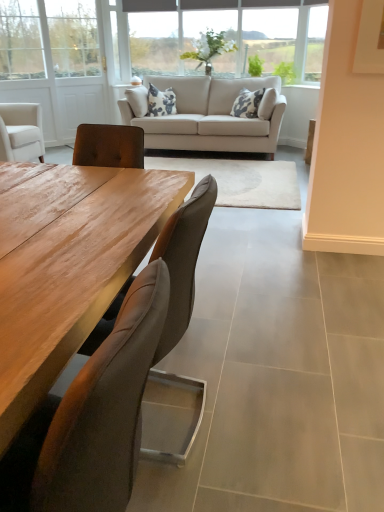
Question: From the image's perspective, is beige fabric couch at center located beneath leather cushioned chair at center, the 1th chair positioned from the front?

Choices:
 (A) no
 (B) yes

Answer: (A)

Question: Can you confirm if beige fabric couch at center is thinner than leather cushioned chair at center, the 2th chair when ordered from back to front?

Choices:
 (A) yes
 (B) no

Answer: (B)

Question: From a real-world perspective, does beige fabric couch at center stand above leather cushioned chair at center, the 1th chair positioned from the front?

Choices:
 (A) no
 (B) yes

Answer: (B)

Question: Is beige fabric couch at center directly adjacent to leather cushioned chair at center, the 1th chair positioned from the front?

Choices:
 (A) no
 (B) yes

Answer: (A)

Question: Is beige fabric couch at center to the left of leather cushioned chair at center, the 2th chair when ordered from back to front, from the viewer's perspective?

Choices:
 (A) yes
 (B) no

Answer: (B)

Question: From the image's perspective, is brown leather chair at center, arranged as the second chair when viewed from the front, located above or below white wood screen door at upper left?

Choices:
 (A) above
 (B) below

Answer: (B)

Question: Would you say brown leather chair at center, arranged as the second chair when viewed from the front, is inside or outside white wood screen door at upper left?

Choices:
 (A) inside
 (B) outside

Answer: (B)

Question: From a real-world perspective, is brown leather chair at center, the first chair positioned from the back, positioned above or below white wood screen door at upper left?

Choices:
 (A) above
 (B) below

Answer: (B)

Question: Looking at the image, does brown leather chair at center, the first chair positioned from the back, seem bigger or smaller compared to white wood screen door at upper left?

Choices:
 (A) small
 (B) big

Answer: (A)

Question: Does point (165, 230) appear closer or farther from the camera than point (72, 426)?

Choices:
 (A) closer
 (B) farther

Answer: (B)

Question: From the image's perspective, is brown leather chair at center, the first chair positioned from the back, above or below leather cushioned chair at center, the 2th chair when ordered from back to front?

Choices:
 (A) above
 (B) below

Answer: (A)

Question: Is brown leather chair at center, arranged as the second chair when viewed from the front, inside or outside of leather cushioned chair at center, the 1th chair positioned from the front?

Choices:
 (A) outside
 (B) inside

Answer: (A)

Question: Considering their positions, is brown leather chair at center, the first chair positioned from the back, located in front of or behind leather cushioned chair at center, the 2th chair when ordered from back to front?

Choices:
 (A) behind
 (B) front

Answer: (A)

Question: Relative to brown leather chair at center, the first chair positioned from the back, is clear glass vase at upper center, the 2th window when ordered from left to right, in front or behind?

Choices:
 (A) front
 (B) behind

Answer: (B)

Question: Looking at their shapes, would you say clear glass vase at upper center, which appears as the first window when viewed from the right, is wider or thinner than brown leather chair at center, the first chair positioned from the back?

Choices:
 (A) thin
 (B) wide

Answer: (A)